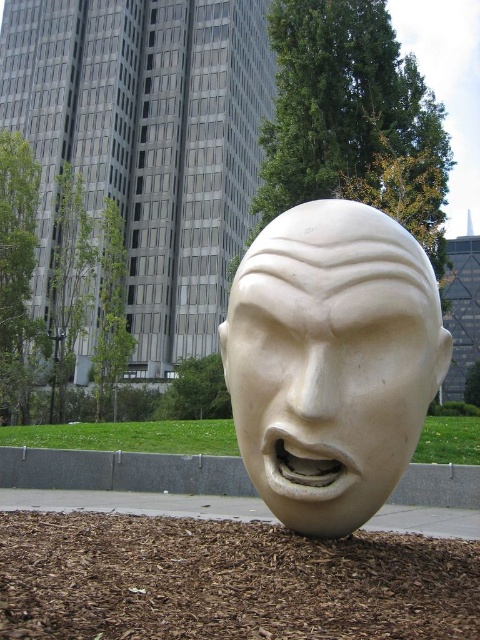
You are a landscape architect designing a garden around the white marble head at center and the brown mulch at lower center. Which object has a smaller width when viewed from above?

The white marble head at center is thinner than the brown mulch at lower center, so it has a smaller width when viewed from above.

You are standing at the point marked as point (331,362) in the image. What object are you facing? Please answer with the object label from the scene.

The point (331,362) corresponds to the white marble head at center, so you are facing the white marble head at center.

You are standing in front of the sculpture and want to walk towards the brown mulch at lower center. Which direction should you move relative to the white marble head at center?

To reach the brown mulch at lower center, you should move away from the white marble head at center since the sculpture is closer to you than the mulch.